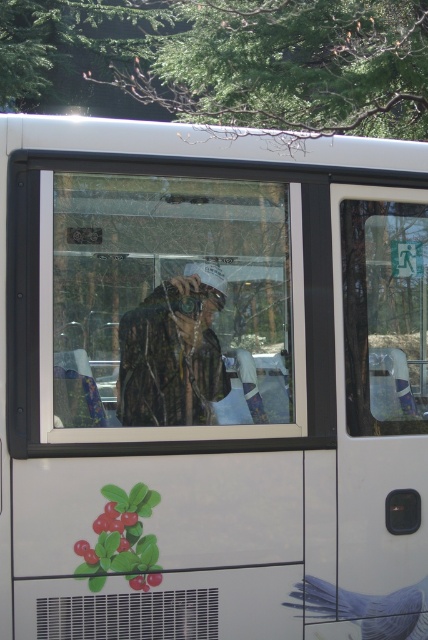
You are a passenger inside the bus and want to see the smooth blue bird at lower right outside the window. Can you see it through the transparent glass window at center?

The transparent glass window at center is located above the smooth blue bird at lower right, so the window is higher up and might not allow you to see the bird below it unless you look downward through the window.

You are standing in front of the bus window and see two points marked on the bus side panel. The first point is at coordinates point (226, 348) and the second is at point (376, 282). Which point do you think is nearer to you?

Point (226, 348) is closer to the viewer than point (376, 282).